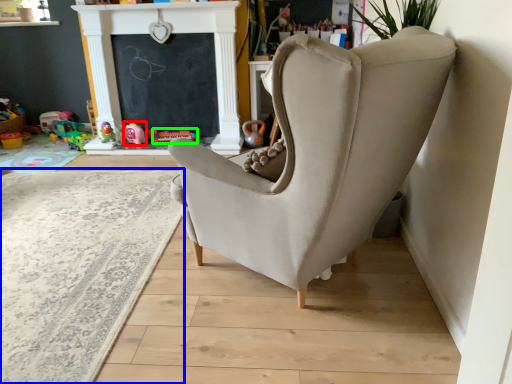
Question: Based on their relative distances, which object is farther from toy (highlighted by a red box)? Choose from plain (highlighted by a blue box) and toy (highlighted by a green box).

Choices:
 (A) plain
 (B) toy

Answer: (A)